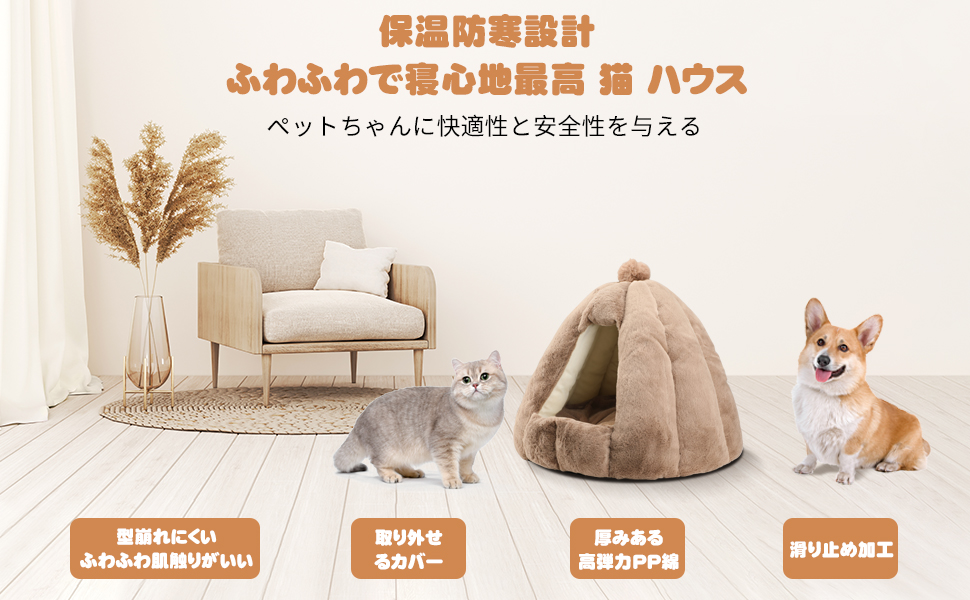
The width and height of the screenshot is (970, 600). Identify the location of pillow. (344, 273).